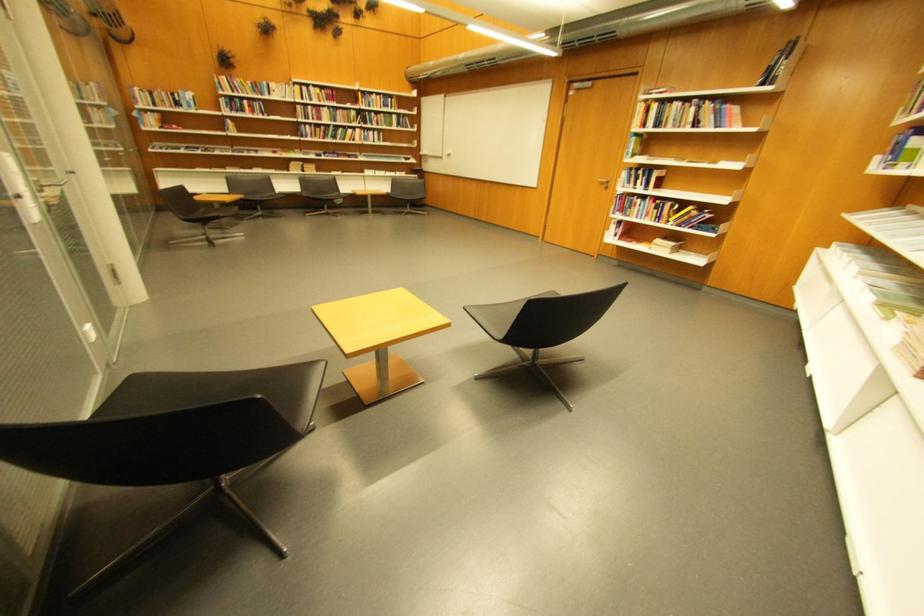
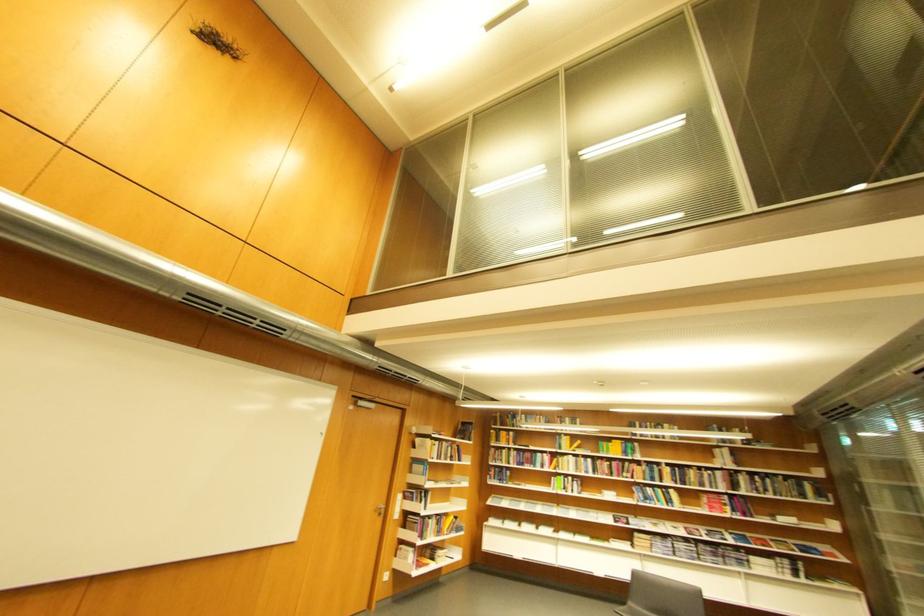
Find the pixel in the second image that matches point (703, 129) in the first image.

(460, 461)